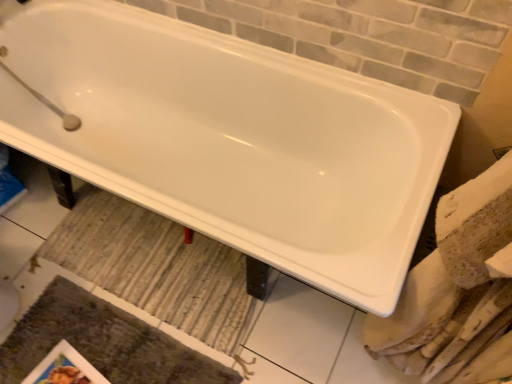
Locate an element on the screen. vacant area that lies between textured gray bath mat at lower left, which is the 1th bath mat in bottom-to-top order, and striped fabric bath mat at center, the 1th bath mat when ordered from top to bottom is located at coordinates (57, 272).